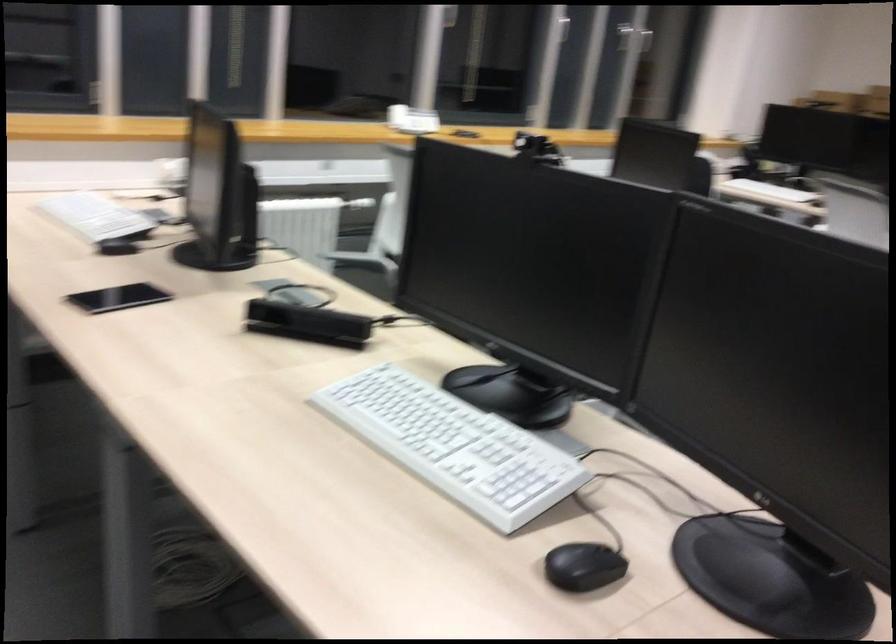
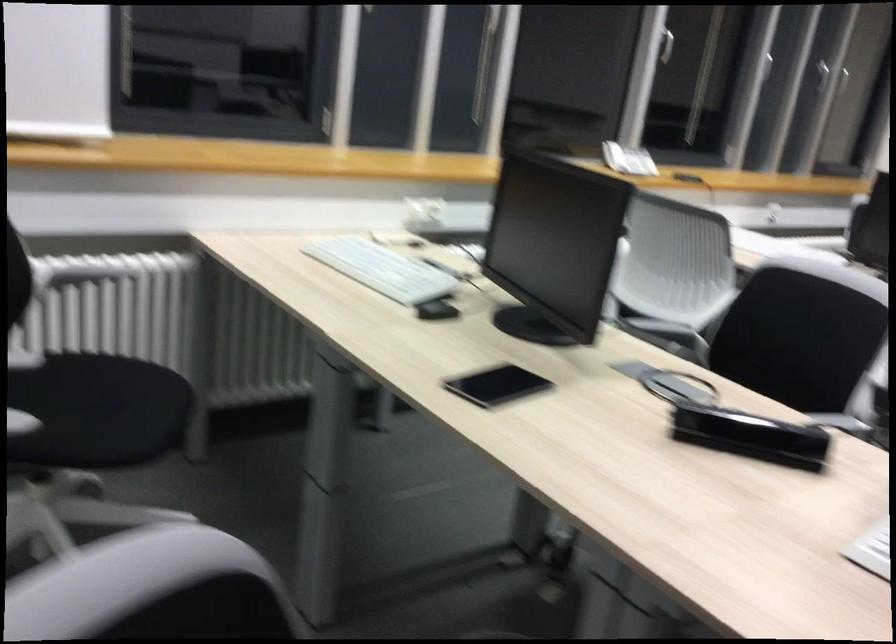
What movement of the cameraman would produce the second image?

The cameraman walked toward left, forward.